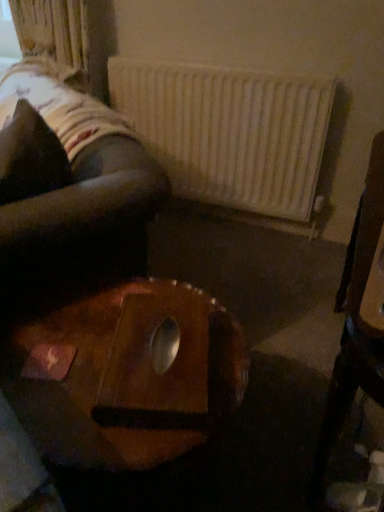
Question: From the image's perspective, relative to wooden chair at right, is velvety black pillow at upper left above or below?

Choices:
 (A) below
 (B) above

Answer: (B)

Question: Based on their positions, is velvety black pillow at upper left located to the left or right of wooden chair at right?

Choices:
 (A) right
 (B) left

Answer: (B)

Question: Based on their relative distances, which object is farther from the wooden chair at right?

Choices:
 (A) white matte radiator at upper center
 (B) velvety black pillow at upper left
 (C) wooden table at center

Answer: (A)

Question: Based on their relative distances, which object is farther from the velvety black pillow at upper left?

Choices:
 (A) wooden chair at right
 (B) white matte radiator at upper center
 (C) wooden table at center

Answer: (B)